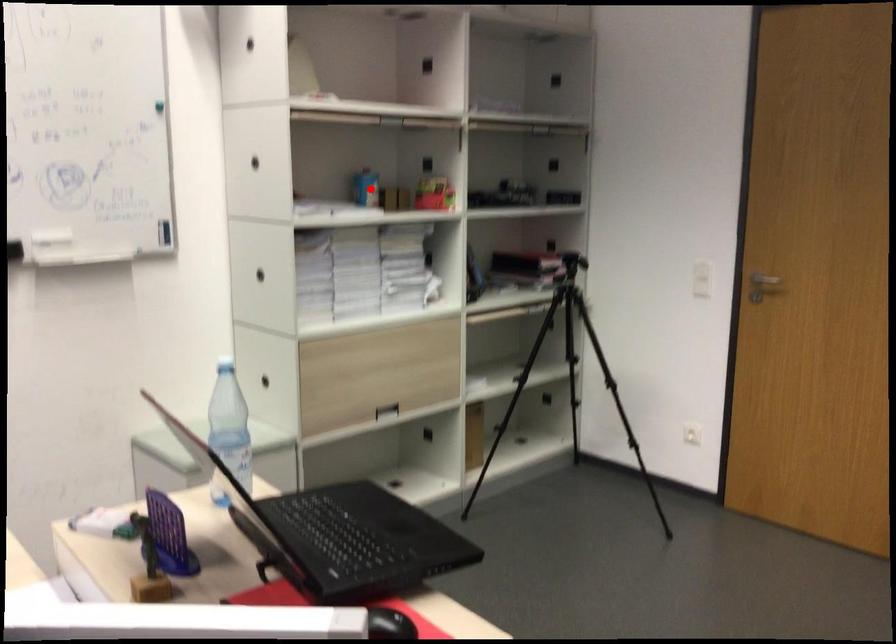
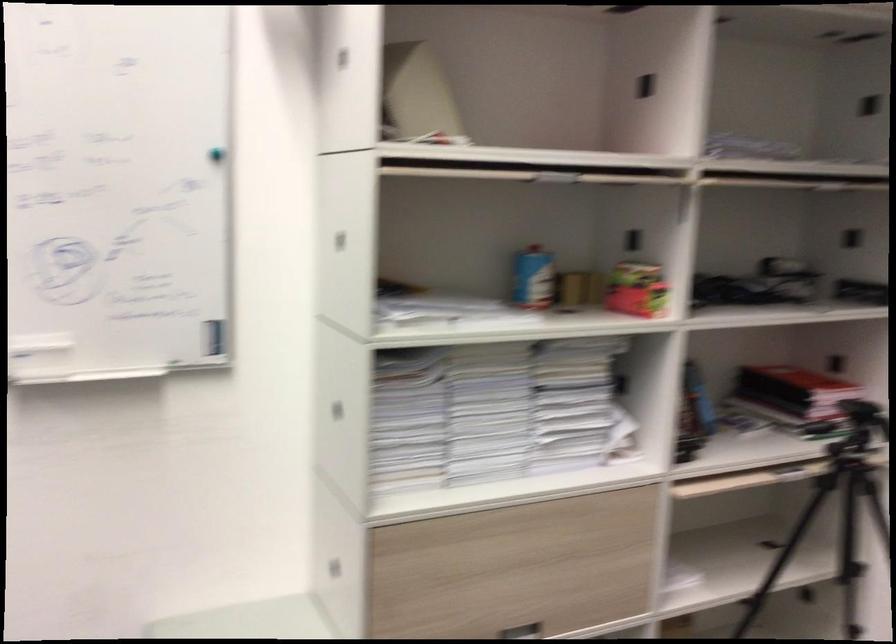
Question: A red point is marked in image1. In image2, is the corresponding 3D point closer to the camera or farther? Reply with the corresponding letter.

Choices:
 (A) The corresponding 3D point is closer.
 (B) The corresponding 3D point is farther.

Answer: (A)